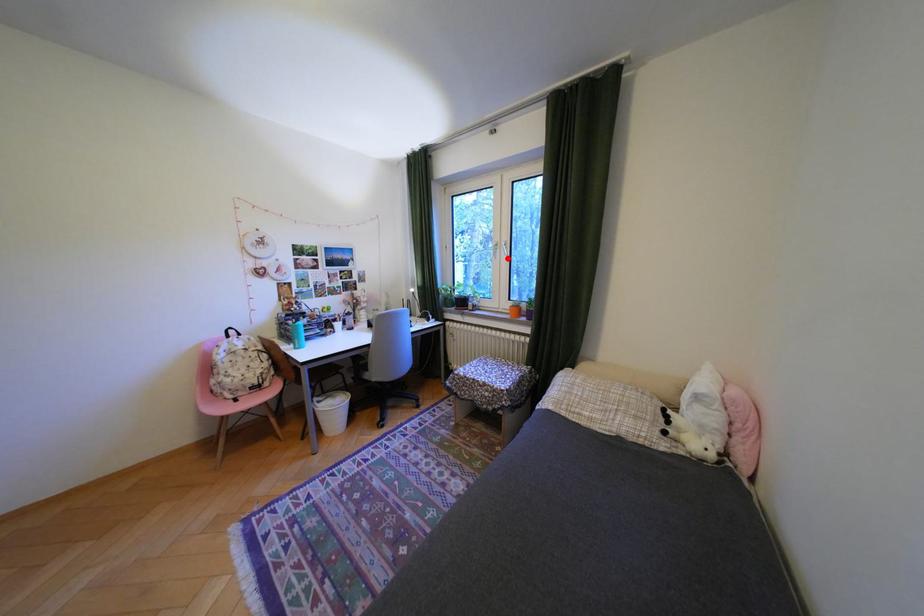
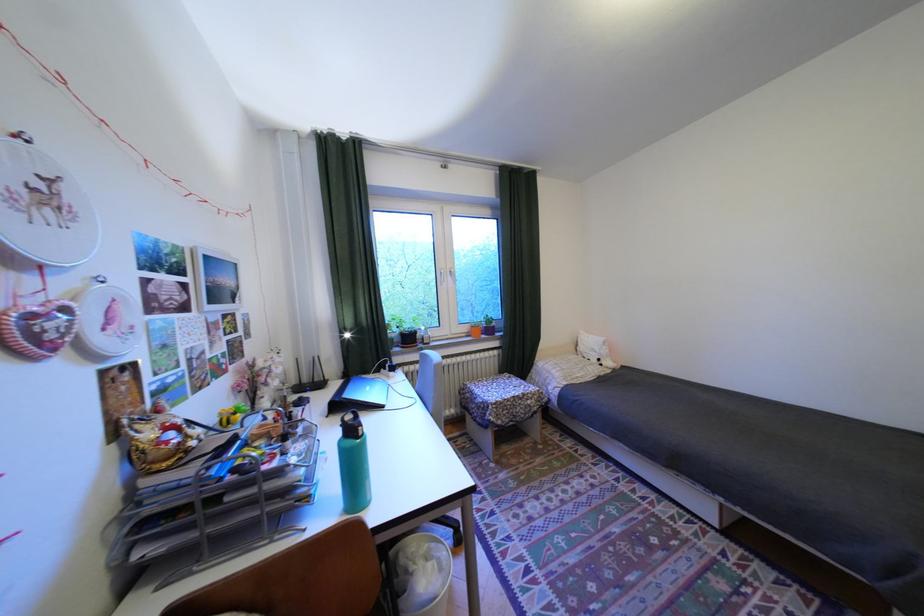
In the second image, find the point that corresponds to the highlighted location in the first image.

(454, 285)